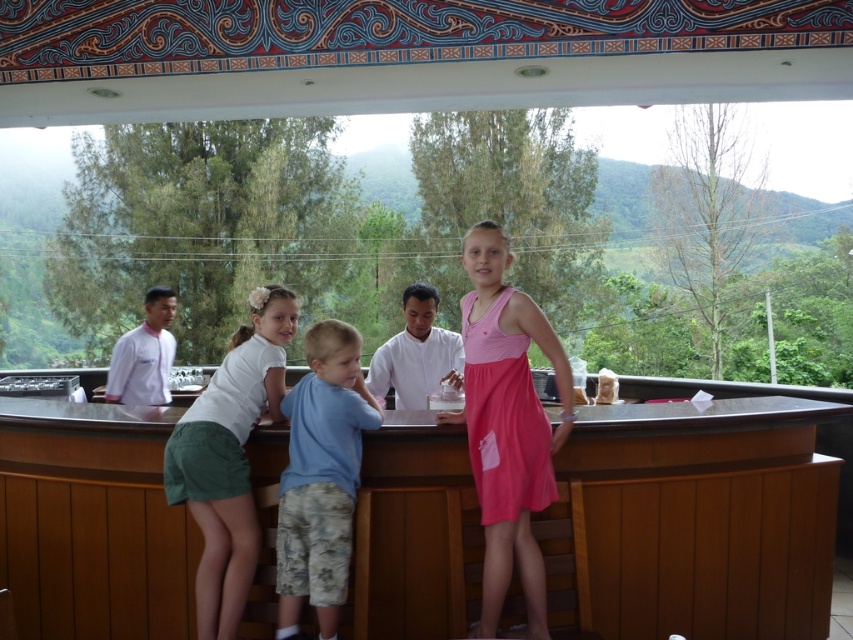
Question: Which point is farther to the camera?

Choices:
 (A) pink satin dress at center
 (B) clear plastic cup at center

Answer: (B)

Question: Is blue cotton shirt at center bigger than white uniform at left?

Choices:
 (A) no
 (B) yes

Answer: (A)

Question: Can you confirm if white uniform at left is thinner than clear plastic cup at center?

Choices:
 (A) no
 (B) yes

Answer: (A)

Question: Which of these objects is positioned farthest from the white uniform at left?

Choices:
 (A) white smooth shirt at center
 (B) pink satin dress at center

Answer: (B)

Question: Is white cotton shirt at center below white uniform at left?

Choices:
 (A) yes
 (B) no

Answer: (A)

Question: Which is farther from the pink satin dress at center?

Choices:
 (A) white smooth shirt at center
 (B) clear plastic cup at center
 (C) white uniform at left
 (D) white cotton shirt at center

Answer: (C)